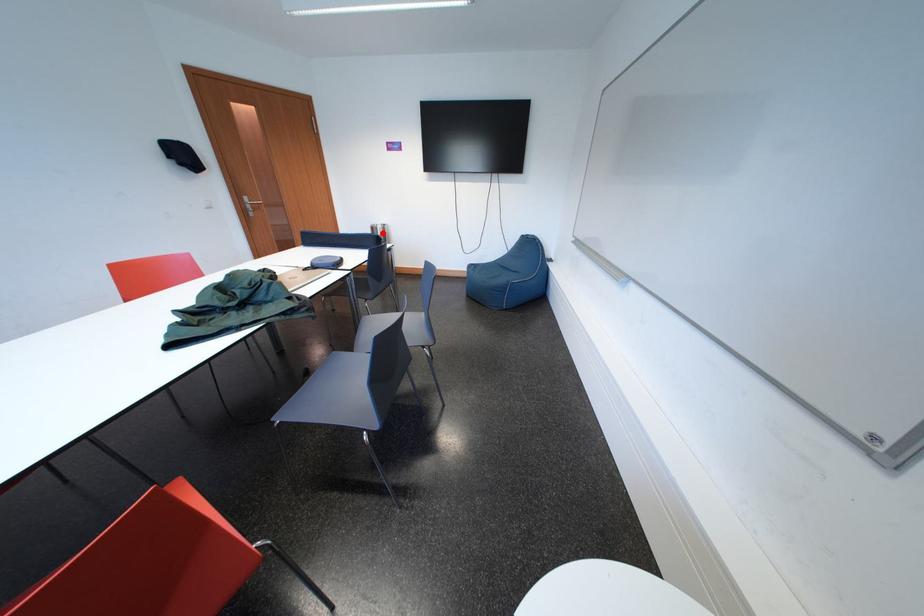
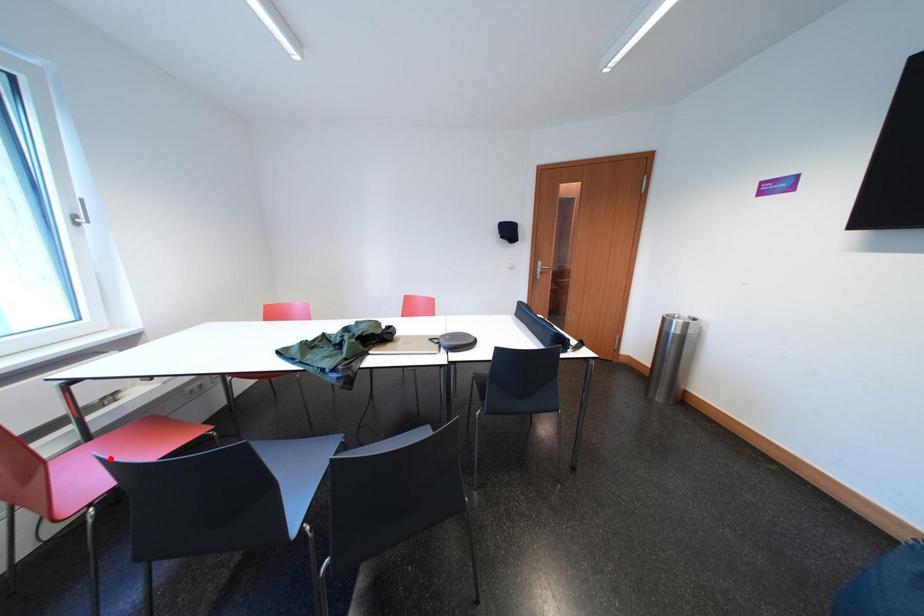
I am providing you with two images of the same scene from different viewpoints. A red point is marked on the first image and another point is marked on the second image. Do the highlighted points in image1 and image2 indicate the same real-world spot?

No